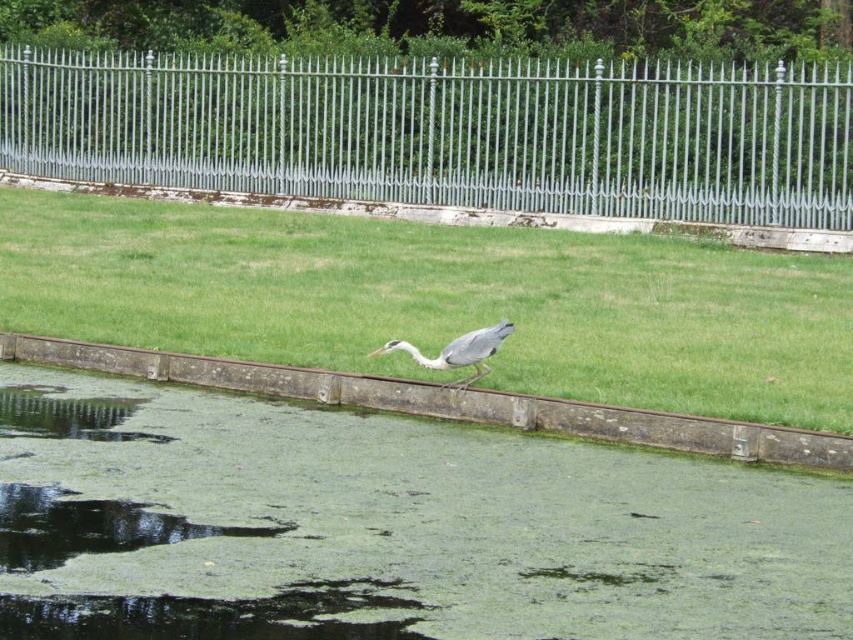
You are a photographer trying to capture the heron in the scene. You notice two points marked in the image at coordinates point (161, 154) and point (436, 360). Which point is closer to your camera position?

Point (161, 154) is further to the viewer than point (436, 360). Therefore, point (161, 154) is closer to the camera position.

You are a photographer trying to capture the brown concrete ledge at center and the silver metallic fence at upper center in the same frame. Based on their positions, which object would appear closer to the camera in the photo?

The silver metallic fence at upper center would appear closer to the camera because the brown concrete ledge at center is behind it.